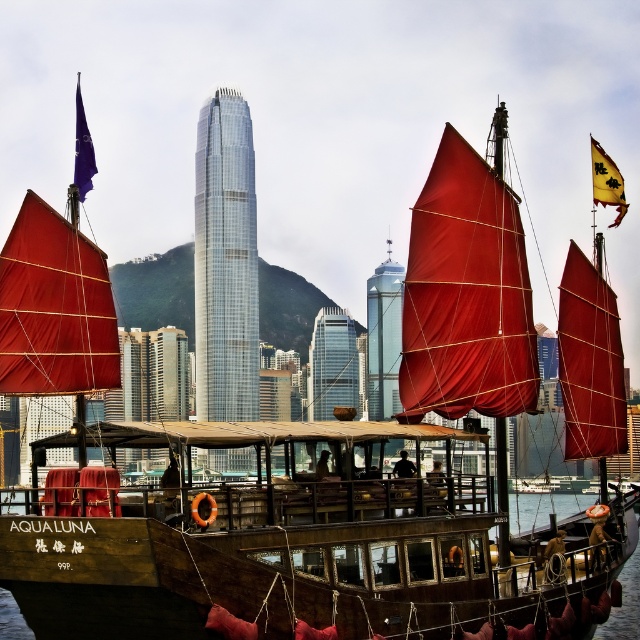
Is point (387, 528) more distant than point (468, 221)?

No, it is not.

Does point (609, 573) lie in front of point (508, 275)?

Yes, it is.

Is point (225, 536) positioned in front of point (449, 269)?

Yes, it is.

The height and width of the screenshot is (640, 640). I want to click on wooden boat at lower center, so click(x=310, y=566).